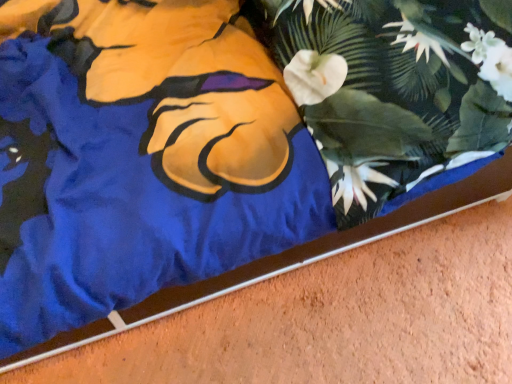
Measure the distance between matte blue t-shirt at center and camera.

The distance of matte blue t-shirt at center from camera is 22.48 inches.

Where is `matte blue t-shirt at center`? Image resolution: width=512 pixels, height=384 pixels. matte blue t-shirt at center is located at coordinates point(123,199).

The width and height of the screenshot is (512, 384). What do you see at coordinates (123, 199) in the screenshot? I see `matte blue t-shirt at center` at bounding box center [123, 199].

Where is `matte blue t-shirt at center`? Image resolution: width=512 pixels, height=384 pixels. matte blue t-shirt at center is located at coordinates (123, 199).